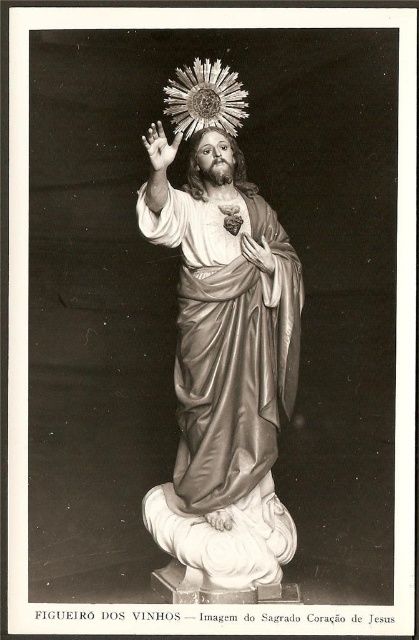
You are standing in front of the Sacred Heart of Jesus statue and notice two points marked on the statue. The first point is at coordinates point (229,273) and the second point is at point (274,266). Which of these two points is closer to you?

Point (229,273) is in front of point (274,266), so the first point is closer to you.

From the picture: You are standing 25 feet away from the Sacred Heart of Jesus statue. You want to touch the smooth skin hand at upper center. Can you reach it without moving closer?

The smooth skin hand at upper center is 24.08 feet away from the viewer. Since you are standing 25 feet away, you are currently 1 foot too far to reach it. You need to move 1 foot closer to touch it.

You are an art conservator examining the statue from the front. You notice two points marked on the statue, point 1 at coordinates point (149, 148) and point 2 at coordinates point (260, 248). Which point is closer to your current position?

Point (149, 148) is closer to the viewer than point (260, 248).